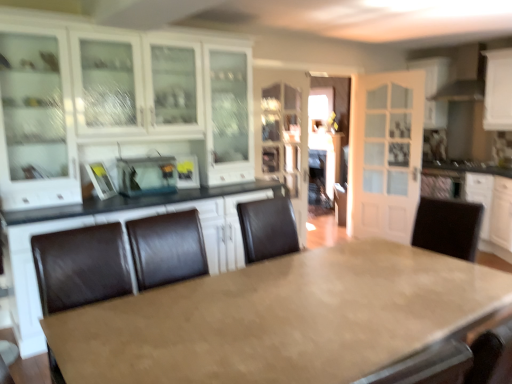
What is the approximate height of white glossy cabinet at upper right, which is counted as the 1th cabinetry, starting from the right?

It is 33.08 inches.

The height and width of the screenshot is (384, 512). Describe the element at coordinates (283, 134) in the screenshot. I see `matte glass cabinet at center, which appears as the third cabinetry when viewed from the right` at that location.

What is the approximate width of matte glass cabinet at center, which appears as the third cabinetry when viewed from the right?

The width of matte glass cabinet at center, which appears as the third cabinetry when viewed from the right, is 1.47 inches.

I want to click on metallic silver toaster at center, the second appliance in the right-to-left sequence, so click(146, 176).

What do you see at coordinates (485, 201) in the screenshot? The image size is (512, 384). I see `white glossy cabinet at right, the 3th cabinetry in the left-to-right sequence` at bounding box center [485, 201].

Where is `matte brown table at center`? matte brown table at center is located at coordinates (282, 319).

Does white glossy cabinet at upper left, the 1th cabinetry when ordered from left to right, come behind white glossy cabinet at upper right, which appears as the 4th cabinetry when viewed from the left?

No, white glossy cabinet at upper left, the 1th cabinetry when ordered from left to right, is closer to the viewer.

Looking at their sizes, would you say white glossy cabinet at upper left, the 1th cabinetry when ordered from left to right, is wider or thinner than white glossy cabinet at upper right, which is counted as the 1th cabinetry, starting from the right?

In the image, white glossy cabinet at upper left, the 1th cabinetry when ordered from left to right, appears to be wider than white glossy cabinet at upper right, which is counted as the 1th cabinetry, starting from the right.

How many degrees apart are the facing directions of white glossy cabinet at upper left, which is the fourth cabinetry from right to left, and white glossy cabinet at upper right, which is counted as the 1th cabinetry, starting from the right?

white glossy cabinet at upper left, which is the fourth cabinetry from right to left, and white glossy cabinet at upper right, which is counted as the 1th cabinetry, starting from the right, are facing 88.5 degrees away from each other.

There is a white glossy cabinet at upper right, which is counted as the 1th cabinetry, starting from the right. Identify the location of the 1st cabinetry below it (from a real-world perspective). (114, 103).

Is metallic silver toaster at center, which is the 1th appliance from left to right, oriented towards matte glass cabinet at center, which appears as the third cabinetry when viewed from the right?

No, metallic silver toaster at center, which is the 1th appliance from left to right, does not turn towards matte glass cabinet at center, which appears as the third cabinetry when viewed from the right.

From the picture: Choose the correct answer: Is metallic silver toaster at center, the second appliance in the right-to-left sequence, inside matte glass cabinet at center, acting as the 2th cabinetry starting from the left, or outside it?

metallic silver toaster at center, the second appliance in the right-to-left sequence, exists outside the volume of matte glass cabinet at center, acting as the 2th cabinetry starting from the left.

From a real-world perspective, count 1st cabinetrys downward from the metallic silver toaster at center, which is the 1th appliance from left to right, and point to it. Please provide its 2D coordinates.

[(283, 134)]

Considering the relative positions of metallic silver toaster at center, which is the 1th appliance from left to right, and matte glass cabinet at center, acting as the 2th cabinetry starting from the left, in the image provided, is metallic silver toaster at center, which is the 1th appliance from left to right, in front of matte glass cabinet at center, acting as the 2th cabinetry starting from the left,?

Yes, metallic silver toaster at center, which is the 1th appliance from left to right, is closer to the camera.

Could you tell me if matte brown table at center is facing metallic silver toaster at center, the second appliance in the right-to-left sequence?

No, matte brown table at center is not facing towards metallic silver toaster at center, the second appliance in the right-to-left sequence.

Which object is closer to the camera, matte brown table at center or metallic silver toaster at center, the second appliance in the right-to-left sequence?

matte brown table at center.

Does matte brown table at center have a greater width compared to metallic silver toaster at center, which is the 1th appliance from left to right?

Correct, the width of matte brown table at center exceeds that of metallic silver toaster at center, which is the 1th appliance from left to right.

From a real-world perspective, who is located higher, matte black toaster at center, which is the first appliance in right-to-left order, or metallic silver toaster at center, which is the 1th appliance from left to right?

In real-world perspective, metallic silver toaster at center, which is the 1th appliance from left to right, is above.

Considering the points (193, 184) and (136, 188), which point is in front, point (193, 184) or point (136, 188)?

The point (136, 188) is more forward.

In the scene shown: Is matte black toaster at center, which is the 2th appliance from left to right, facing away from metallic silver toaster at center, the second appliance in the right-to-left sequence?

No, matte black toaster at center, which is the 2th appliance from left to right, is not facing away from metallic silver toaster at center, the second appliance in the right-to-left sequence.

Can we say matte black toaster at center, which is the 2th appliance from left to right, lies outside metallic silver toaster at center, the second appliance in the right-to-left sequence?

That's correct, matte black toaster at center, which is the 2th appliance from left to right, is outside of metallic silver toaster at center, the second appliance in the right-to-left sequence.

Is white glossy cabinet at right, positioned as the 2th cabinetry in right-to-left order, positioned behind matte glass cabinet at center, which appears as the third cabinetry when viewed from the right?

Yes, it is behind matte glass cabinet at center, which appears as the third cabinetry when viewed from the right.

Is white glossy cabinet at right, the 3th cabinetry in the left-to-right sequence, bigger than matte glass cabinet at center, acting as the 2th cabinetry starting from the left?

Yes.

Does white glossy cabinet at right, the 3th cabinetry in the left-to-right sequence, have a lesser height compared to matte glass cabinet at center, which appears as the third cabinetry when viewed from the right?

Correct, white glossy cabinet at right, the 3th cabinetry in the left-to-right sequence, is not as tall as matte glass cabinet at center, which appears as the third cabinetry when viewed from the right.

Is white glossy cabinet at right, positioned as the 2th cabinetry in right-to-left order, wider or thinner than matte glass cabinet at center, acting as the 2th cabinetry starting from the left?

Clearly, white glossy cabinet at right, positioned as the 2th cabinetry in right-to-left order, has more width compared to matte glass cabinet at center, acting as the 2th cabinetry starting from the left.

Is matte glass cabinet at center, acting as the 2th cabinetry starting from the left, to the left of white glossy exhaust hood at upper right from the viewer's perspective?

Yes.

Which point is more forward, [288,88] or [455,58]?

The point [288,88] is closer to the camera.

From the image's perspective, is matte glass cabinet at center, which appears as the third cabinetry when viewed from the right, above white glossy exhaust hood at upper right?

Incorrect, from the image's perspective, matte glass cabinet at center, which appears as the third cabinetry when viewed from the right, is lower than white glossy exhaust hood at upper right.

Considering the sizes of objects matte glass cabinet at center, acting as the 2th cabinetry starting from the left, and white glossy exhaust hood at upper right in the image provided, who is thinner, matte glass cabinet at center, acting as the 2th cabinetry starting from the left, or white glossy exhaust hood at upper right?

With smaller width is matte glass cabinet at center, acting as the 2th cabinetry starting from the left.

From the image's perspective, is white glossy cabinet at upper right, which is counted as the 1th cabinetry, starting from the right, above or below matte glass cabinet at center, acting as the 2th cabinetry starting from the left?

From the image's perspective, white glossy cabinet at upper right, which is counted as the 1th cabinetry, starting from the right, appears above matte glass cabinet at center, acting as the 2th cabinetry starting from the left.

Is white glossy cabinet at upper right, which is counted as the 1th cabinetry, starting from the right, completely or partially outside of matte glass cabinet at center, which appears as the third cabinetry when viewed from the right?

That's correct, white glossy cabinet at upper right, which is counted as the 1th cabinetry, starting from the right, is outside of matte glass cabinet at center, which appears as the third cabinetry when viewed from the right.

How far apart are white glossy cabinet at upper right, which appears as the 4th cabinetry when viewed from the left, and matte glass cabinet at center, which appears as the third cabinetry when viewed from the right?

7.26 feet.

How many degrees apart are the facing directions of white glossy cabinet at upper right, which appears as the 4th cabinetry when viewed from the left, and matte glass cabinet at center, acting as the 2th cabinetry starting from the left?

The facing directions of white glossy cabinet at upper right, which appears as the 4th cabinetry when viewed from the left, and matte glass cabinet at center, acting as the 2th cabinetry starting from the left, are 88.9 degrees apart.

Identify the location of cabinetry above the white glossy cabinet at upper left, the 1th cabinetry when ordered from left to right (from a real-world perspective). (498, 90).

Which cabinetry is the 2nd one when counting from the right side of the metallic silver toaster at center, which is the 1th appliance from left to right? Please provide its 2D coordinates.

[(283, 134)]

Estimate the real-world distances between objects in this image. Which object is further from white glossy exhaust hood at upper right, matte glass cabinet at center, which appears as the third cabinetry when viewed from the right, or white glossy cabinet at right, the 3th cabinetry in the left-to-right sequence?

matte glass cabinet at center, which appears as the third cabinetry when viewed from the right.

When comparing their distances from matte brown table at center, does matte black toaster at center, which is the 2th appliance from left to right, or white glass door at upper right seem further?

Among the two, white glass door at upper right is located further to matte brown table at center.

Based on their spatial positions, is metallic silver toaster at center, which is the 1th appliance from left to right, or white glossy cabinet at upper right, which appears as the 4th cabinetry when viewed from the left, further from white glossy exhaust hood at upper right?

metallic silver toaster at center, which is the 1th appliance from left to right, lies further to white glossy exhaust hood at upper right than the other object.

When comparing their distances from white glossy cabinet at right, positioned as the 2th cabinetry in right-to-left order, does white glossy cabinet at upper right, which appears as the 4th cabinetry when viewed from the left, or white glossy cabinet at upper left, which is the fourth cabinetry from right to left, seem closer?

white glossy cabinet at upper right, which appears as the 4th cabinetry when viewed from the left, is closer to white glossy cabinet at right, positioned as the 2th cabinetry in right-to-left order.

When comparing their distances from white glass door at upper right, does metallic silver toaster at center, the second appliance in the right-to-left sequence, or white glossy cabinet at upper left, the 1th cabinetry when ordered from left to right, seem closer?

white glossy cabinet at upper left, the 1th cabinetry when ordered from left to right, lies closer to white glass door at upper right than the other object.

From the image, which object appears to be farther from matte black toaster at center, which is the 2th appliance from left to right, white glossy cabinet at right, positioned as the 2th cabinetry in right-to-left order, or white glossy cabinet at upper right, which is counted as the 1th cabinetry, starting from the right?

Based on the image, white glossy cabinet at upper right, which is counted as the 1th cabinetry, starting from the right, appears to be further to matte black toaster at center, which is the 2th appliance from left to right.

Looking at the image, which one is located closer to matte brown table at center, white glossy cabinet at right, positioned as the 2th cabinetry in right-to-left order, or matte glass cabinet at center, which appears as the third cabinetry when viewed from the right?

Based on the image, matte glass cabinet at center, which appears as the third cabinetry when viewed from the right, appears to be nearer to matte brown table at center.

Looking at the image, which one is located further to white glossy cabinet at upper right, which is counted as the 1th cabinetry, starting from the right, white glass door at upper right or matte glass cabinet at center, acting as the 2th cabinetry starting from the left?

Based on the image, matte glass cabinet at center, acting as the 2th cabinetry starting from the left, appears to be further to white glossy cabinet at upper right, which is counted as the 1th cabinetry, starting from the right.

Identify the location of cabinetry situated between matte black toaster at center, which is the 2th appliance from left to right, and white glass door at upper right from left to right. This screenshot has height=384, width=512. (283, 134).

Locate an element on the screen. door positioned between matte brown table at center and white glossy exhaust hood at upper right from near to far is located at coordinates (385, 154).

Locate an element on the screen. This screenshot has height=384, width=512. exhaust hood between matte black toaster at center, which is the 2th appliance from left to right, and white glossy cabinet at right, positioned as the 2th cabinetry in right-to-left order, in the horizontal direction is located at coordinates (465, 74).

The height and width of the screenshot is (384, 512). Find the location of `cabinetry located between white glass door at upper right and white glossy cabinet at upper right, which is counted as the 1th cabinetry, starting from the right, in the left-right direction`. cabinetry located between white glass door at upper right and white glossy cabinet at upper right, which is counted as the 1th cabinetry, starting from the right, in the left-right direction is located at coordinates (485, 201).